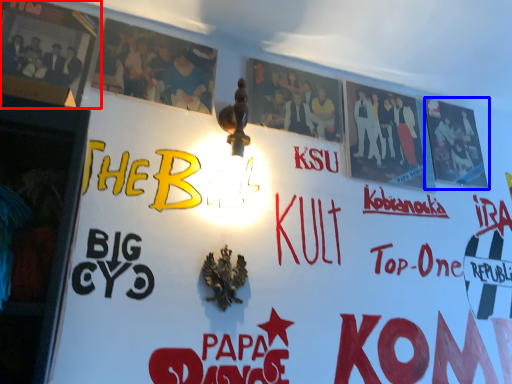
Question: Which object is closer to the camera taking this photo, poster (highlighted by a red box) or poster (highlighted by a blue box)?

Choices:
 (A) poster
 (B) poster

Answer: (A)